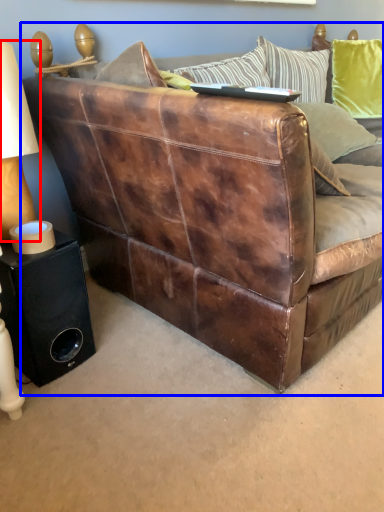
Question: Among these objects, which one is farthest to the camera, table lamp (highlighted by a red box) or studio couch (highlighted by a blue box)?

Choices:
 (A) table lamp
 (B) studio couch

Answer: (A)